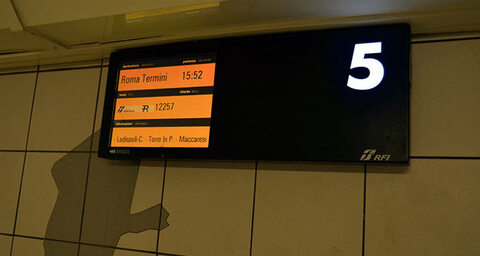
Identify the location of black screen. The width and height of the screenshot is (480, 256). (288, 96).